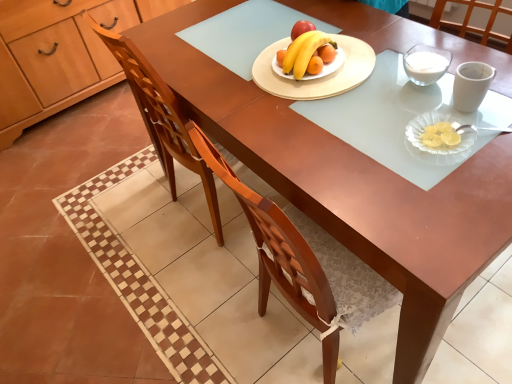
At what (x,y) coordinates should I click in order to perform the action: click on vacant area that is in front of clear glass platter at lower right, which appears as the 2th platter when viewed from the back. Please return your answer as a coordinate pair (x, y). The height and width of the screenshot is (384, 512). Looking at the image, I should click on (458, 185).